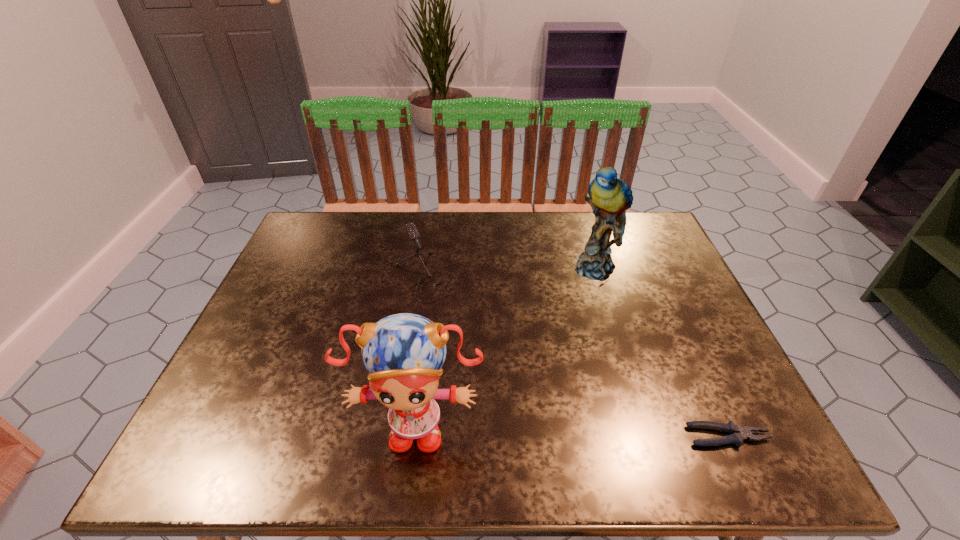
Identify the location of the second tallest object. Image resolution: width=960 pixels, height=540 pixels. (404, 353).

This screenshot has height=540, width=960. What are the coordinates of `the shortest object` in the screenshot? It's located at (738, 434).

Find the location of a particular element. pliers is located at coordinates (738, 434).

What are the coordinates of `the third object from left to right` in the screenshot? It's located at (610, 197).

You are a GUI agent. You are given a task and a screenshot of the screen. Output one action in this format:
    pyautogui.click(x=<x>, y=<y>)
    Task: Click on the parrot
    Image resolution: width=960 pixels, height=540 pixels.
    Given the screenshot: What is the action you would take?
    pyautogui.click(x=610, y=197)

The image size is (960, 540). I want to click on microphone, so click(x=411, y=229).

Where is `vacant space located 0.210m on the face of the third object from left to right`? The image size is (960, 540). vacant space located 0.210m on the face of the third object from left to right is located at coordinates (589, 341).

Find the location of a particular element. vacant region located on the face of the third object from left to right is located at coordinates (585, 377).

This screenshot has width=960, height=540. Find the location of `vacant space located 0.060m on the face of the third object from left to right`. vacant space located 0.060m on the face of the third object from left to right is located at coordinates (594, 299).

Find the location of a particular element. The image size is (960, 540). vacant space located on the stand of the microphone is located at coordinates (458, 314).